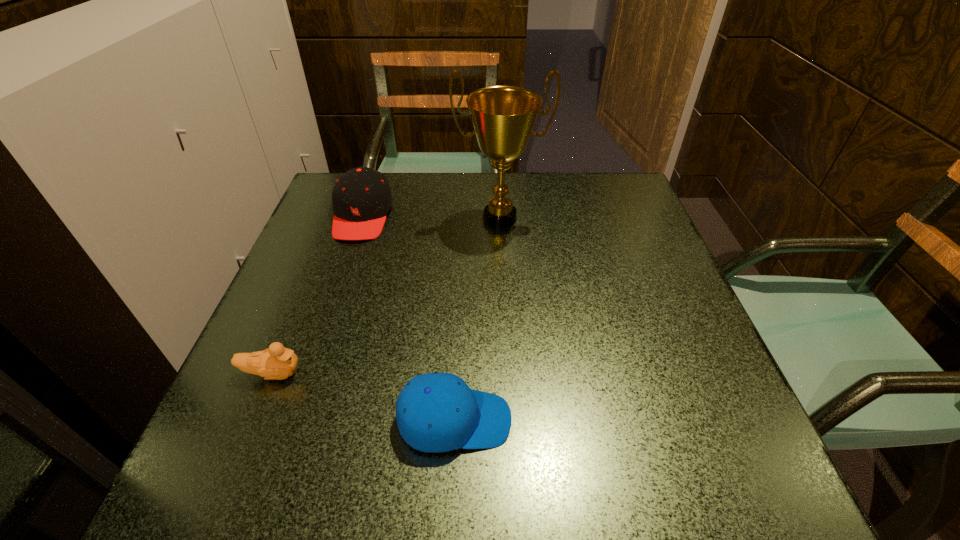
At what (x,y) coordinates should I click in order to perform the action: click on award. Please return your answer as a coordinate pair (x, y). Looking at the image, I should click on (503, 117).

Identify the location of the taller cap. This screenshot has height=540, width=960. (361, 197).

This screenshot has width=960, height=540. What are the coordinates of `the left cap` in the screenshot? It's located at (361, 197).

At what (x,y) coordinates should I click in order to perform the action: click on the nearer cap. Please return your answer as a coordinate pair (x, y). Image resolution: width=960 pixels, height=540 pixels. Looking at the image, I should click on (436, 412).

The width and height of the screenshot is (960, 540). Find the location of `the shorter cap`. the shorter cap is located at coordinates (436, 412).

Find the location of a particular element. The image size is (960, 540). duckling is located at coordinates (276, 363).

Where is `free location located 0.050m on the front view with handles of the award`? This screenshot has height=540, width=960. free location located 0.050m on the front view with handles of the award is located at coordinates (502, 251).

Locate an element on the screen. This screenshot has width=960, height=540. vacant space situated 0.200m on the front-facing side of the farther cap is located at coordinates (332, 307).

Identify the location of free spot located 0.360m on the front-facing side of the right cap. (739, 420).

Where is `free spot located on the face of the duckling`? This screenshot has height=540, width=960. free spot located on the face of the duckling is located at coordinates (448, 374).